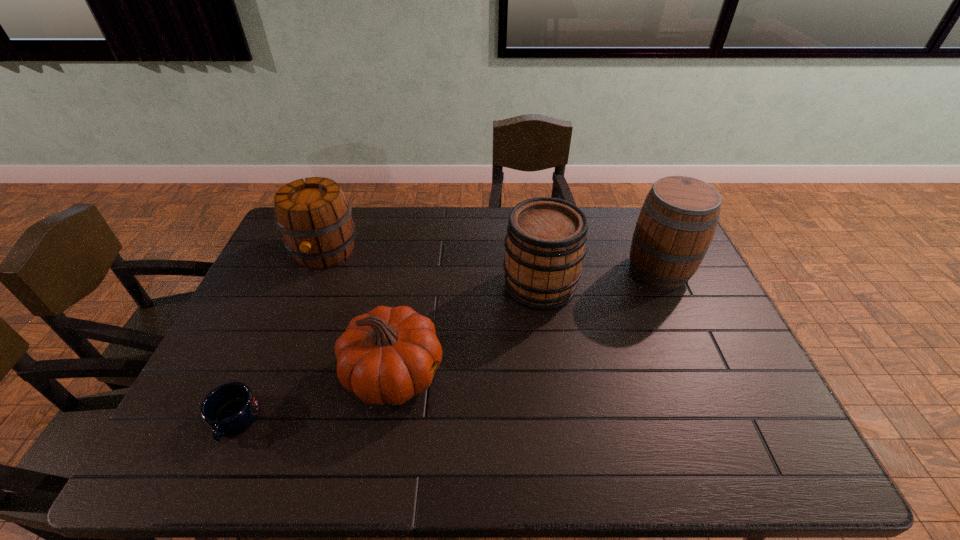
In the image, there is a desktop. Where is `vacant space at the near left corner`? The height and width of the screenshot is (540, 960). vacant space at the near left corner is located at coordinates (201, 443).

The height and width of the screenshot is (540, 960). I want to click on free space at the near right corner, so click(789, 452).

The image size is (960, 540). In order to click on free space between the second cider from right to left and the leftmost cider in this screenshot , I will do `click(432, 268)`.

At what (x,y) coordinates should I click in order to perform the action: click on free spot between the shortest object and the leftmost cider. Please return your answer as a coordinate pair (x, y). The width and height of the screenshot is (960, 540). Looking at the image, I should click on (279, 336).

In order to click on vacant space in between the leftmost cider and the shortest object in this screenshot , I will do `click(279, 336)`.

This screenshot has width=960, height=540. Find the location of `vacant region between the shortest object and the rightmost cider`. vacant region between the shortest object and the rightmost cider is located at coordinates (446, 345).

At what (x,y) coordinates should I click in order to perform the action: click on free area in between the shortest object and the leftmost cider. Please return your answer as a coordinate pair (x, y). Looking at the image, I should click on (279, 336).

Locate an element on the screen. The width and height of the screenshot is (960, 540). free space between the second cider from right to left and the leftmost cider is located at coordinates (432, 268).

Where is `free space that is in between the fourth object from left to right and the leftmost cider`? The height and width of the screenshot is (540, 960). free space that is in between the fourth object from left to right and the leftmost cider is located at coordinates (432, 268).

You are a GUI agent. You are given a task and a screenshot of the screen. Output one action in this format:
    pyautogui.click(x=<x>, y=<y>)
    Task: Click on the vacant area that lies between the rightmost object and the third object from right to left
    
    Given the screenshot: What is the action you would take?
    pyautogui.click(x=526, y=322)